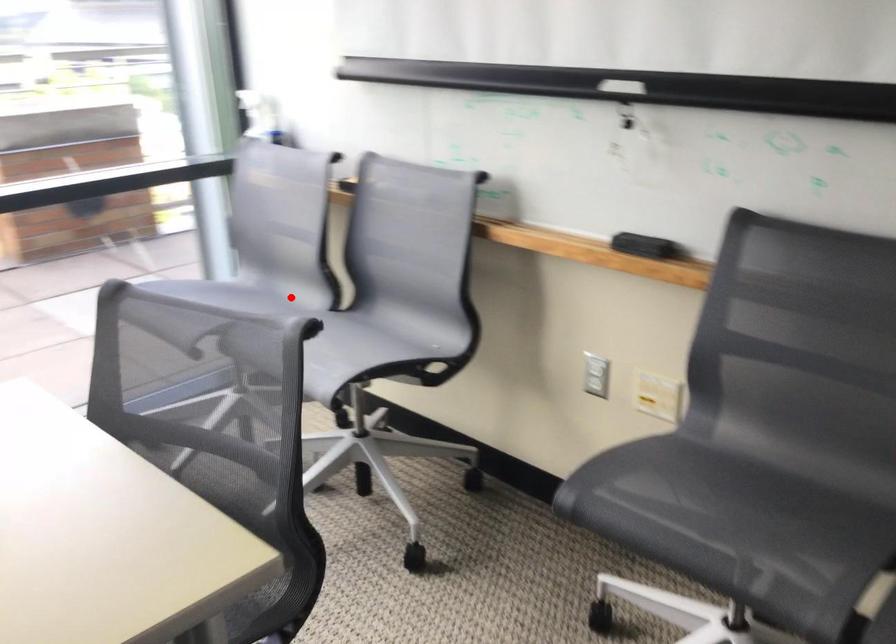
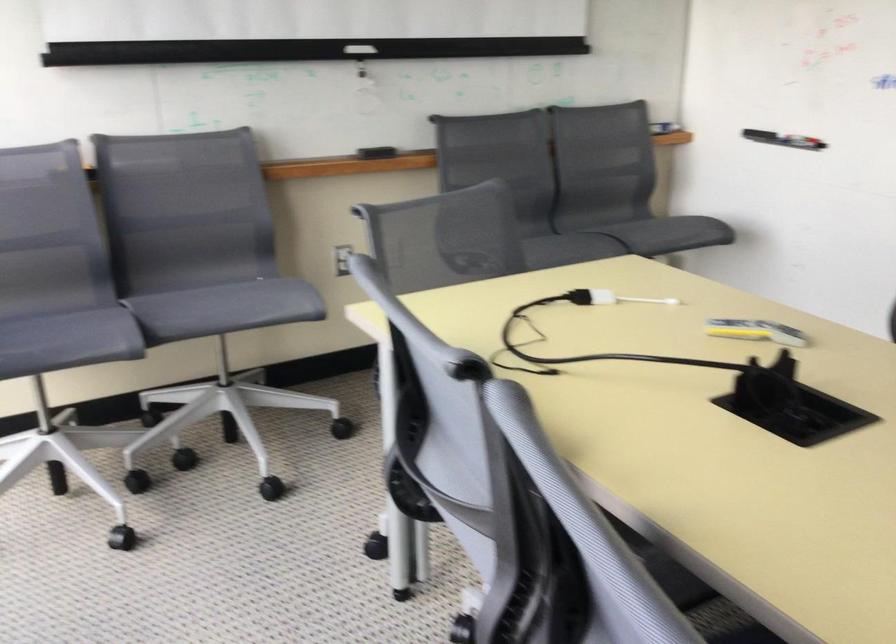
Question: I am providing you with two images of the same scene from different viewpoints. A red point is marked on the first image. At the location where the point appears in image 1, is it still visible in image 2?

Choices:
 (A) Yes
 (B) No

Answer: (A)